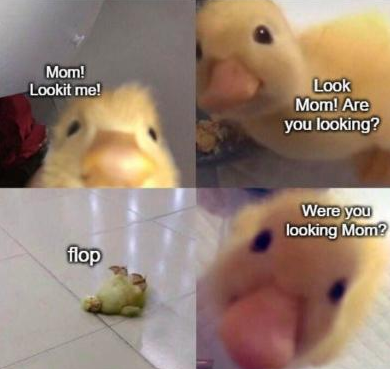
Identify the location of white ceiling. (28, 42).